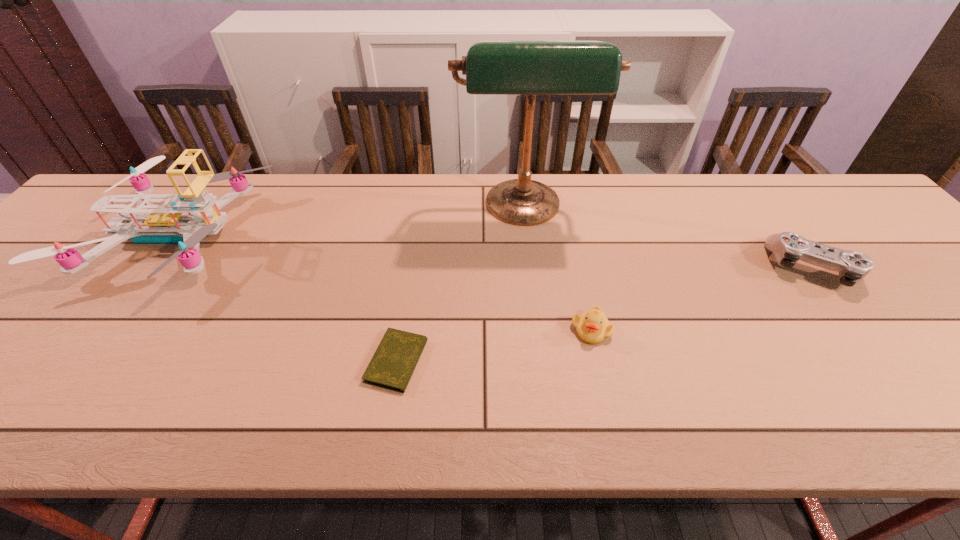
I want to click on the tallest object, so click(x=530, y=68).

The height and width of the screenshot is (540, 960). I want to click on drone, so click(x=184, y=223).

The image size is (960, 540). I want to click on the second tallest object, so click(x=184, y=223).

Locate an element on the screen. This screenshot has height=540, width=960. control is located at coordinates (788, 247).

The image size is (960, 540). Identify the location of duckling. (593, 327).

You are a GUI agent. You are given a task and a screenshot of the screen. Output one action in this format:
    pyautogui.click(x=<x>, y=<y>)
    Task: Click on the fourth object from right to left
    
    Given the screenshot: What is the action you would take?
    pyautogui.click(x=392, y=365)

The height and width of the screenshot is (540, 960). I want to click on diary, so click(392, 365).

Locate an element on the screen. This screenshot has height=540, width=960. free space located 0.090m above the green lampshade of the tallest object is located at coordinates (530, 267).

I want to click on blank space located 0.150m on the front-facing side of the drone, so click(317, 235).

The height and width of the screenshot is (540, 960). Find the location of `vacant space positioned 0.080m on the right of the control`. vacant space positioned 0.080m on the right of the control is located at coordinates (889, 267).